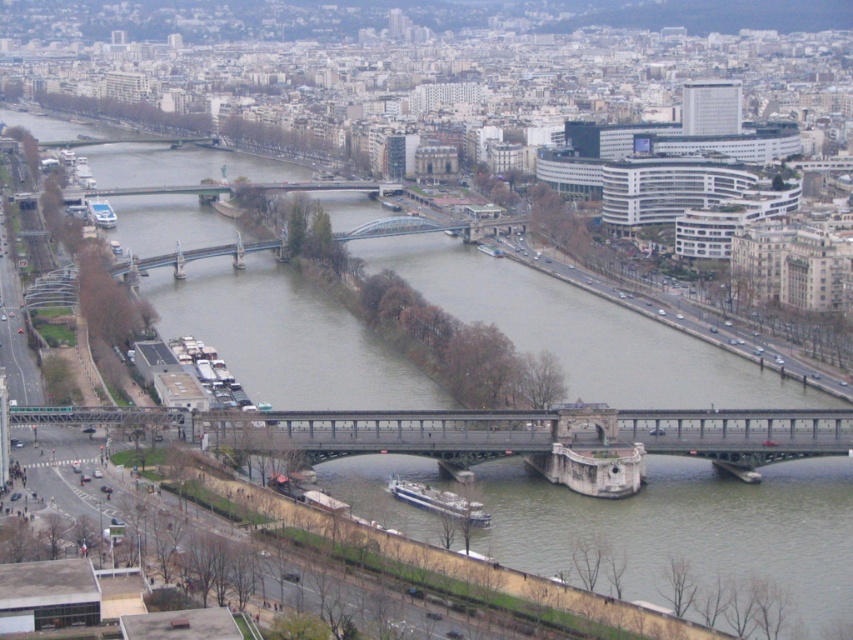
Is green stone bridge at center to the right of white glossy boat at upper left from the viewer's perspective?

Yes, green stone bridge at center is to the right of white glossy boat at upper left.

Which is behind, point (601, 436) or point (86, 209)?

Positioned behind is point (86, 209).

The height and width of the screenshot is (640, 853). Describe the element at coordinates (494, 432) in the screenshot. I see `green stone bridge at center` at that location.

Identify the location of green stone bridge at center. (494, 432).

Which of these two, white glossy ship at lower center or white glossy boat at upper left, stands taller?

Standing taller between the two is white glossy boat at upper left.

Can you confirm if white glossy ship at lower center is positioned to the right of white glossy boat at upper left?

Indeed, white glossy ship at lower center is positioned on the right side of white glossy boat at upper left.

Is point (418, 483) positioned in front of point (102, 214)?

Yes, point (418, 483) is closer to viewer.

The width and height of the screenshot is (853, 640). I want to click on white glossy ship at lower center, so click(x=439, y=500).

Is green stone bridge at center taller than white glossy ship at lower center?

Correct, green stone bridge at center is much taller as white glossy ship at lower center.

Can you confirm if green stone bridge at center is positioned to the right of white glossy ship at lower center?

In fact, green stone bridge at center is to the left of white glossy ship at lower center.

This screenshot has width=853, height=640. What do you see at coordinates (494, 432) in the screenshot?
I see `green stone bridge at center` at bounding box center [494, 432].

Where is `green stone bridge at center`? The image size is (853, 640). green stone bridge at center is located at coordinates (494, 432).